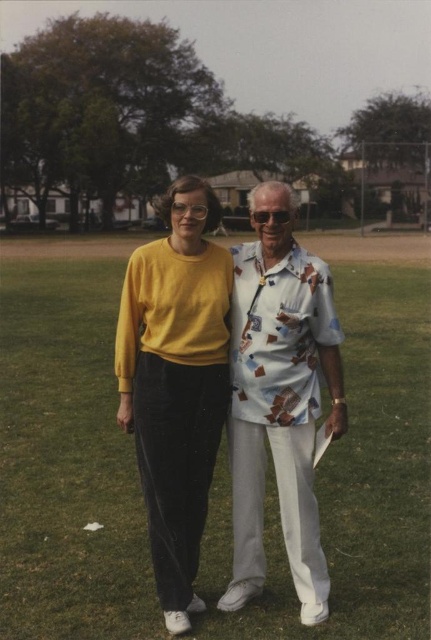
You are a photographer setting up a shot of the two people in the image. You want to ensure that the green grass at center is visible in the foreground while keeping the matte yellow sweater at center in the background. Is this possible given their positions?

The green grass at center is positioned over matte yellow sweater at center, so arranging the shot to have the green grass at center in the foreground and the matte yellow sweater at center in the background is possible since the grass is layered above the sweater.